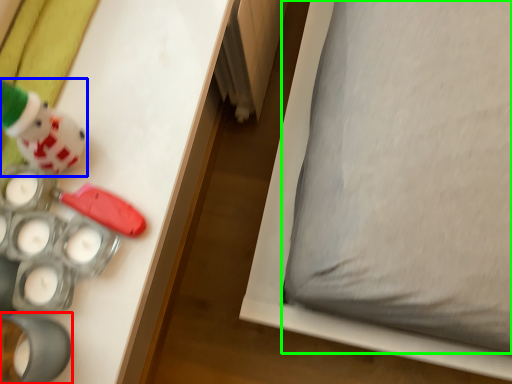
Question: Estimate the real-world distances between objects in this image. Which object is farther from toy (highlighted by a red box), toy (highlighted by a blue box) or pillow (highlighted by a green box)?

Choices:
 (A) toy
 (B) pillow

Answer: (B)